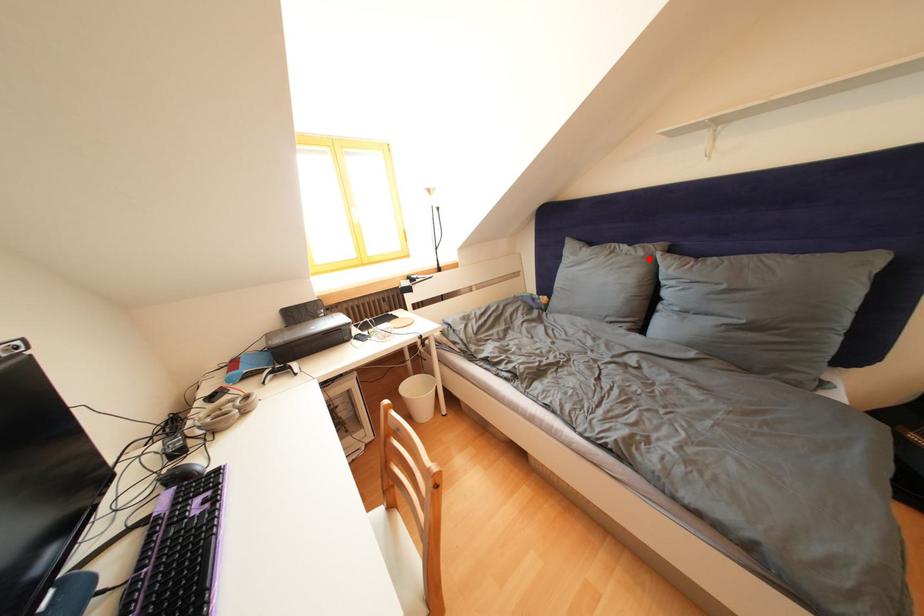
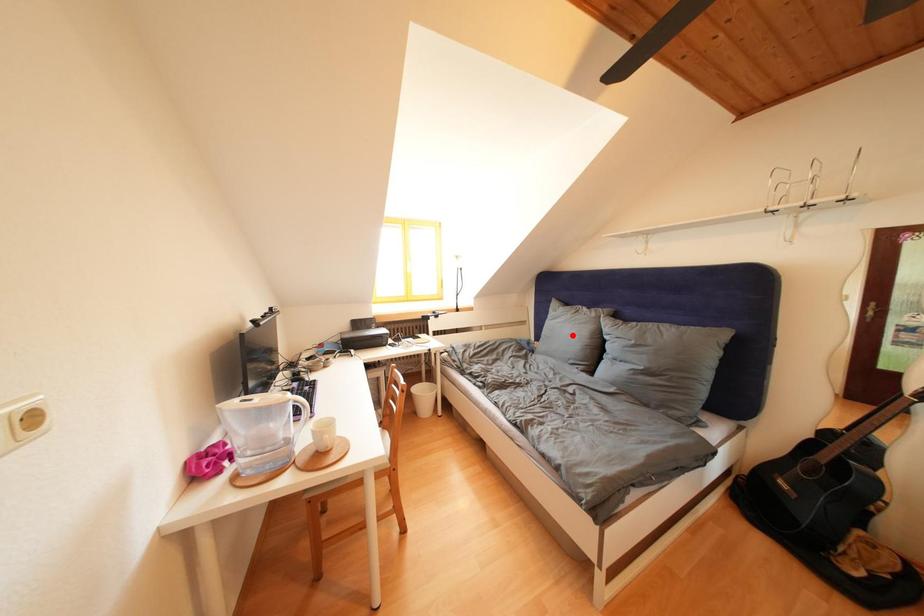
I am providing you with two images of the same scene from different viewpoints. A red point is marked on the first image and another point is marked on the second image. Do the highlighted points in image1 and image2 indicate the same real-world spot?

No